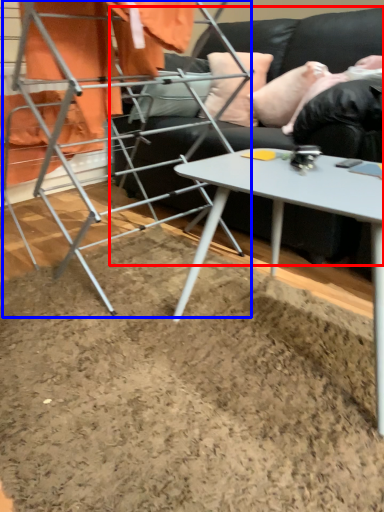
Question: Which of the following is the farthest to the observer, studio couch (highlighted by a red box) or bunk bed (highlighted by a blue box)?

Choices:
 (A) studio couch
 (B) bunk bed

Answer: (A)